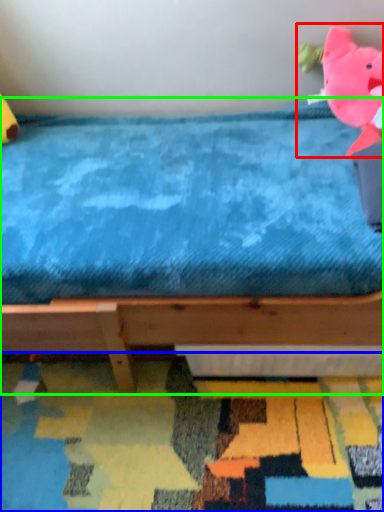
Question: Estimate the real-world distances between objects in this image. Which object is closer to toy (highlighted by a red box), mat (highlighted by a blue box) or bed (highlighted by a green box)?

Choices:
 (A) mat
 (B) bed

Answer: (B)